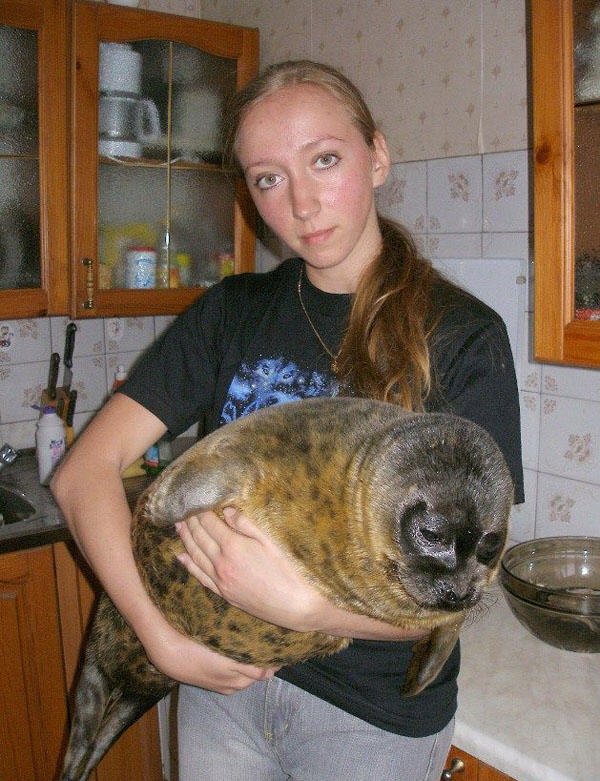
The image size is (600, 781). What are the coordinates of `countertop` in the screenshot? It's located at (504, 699), (52, 523).